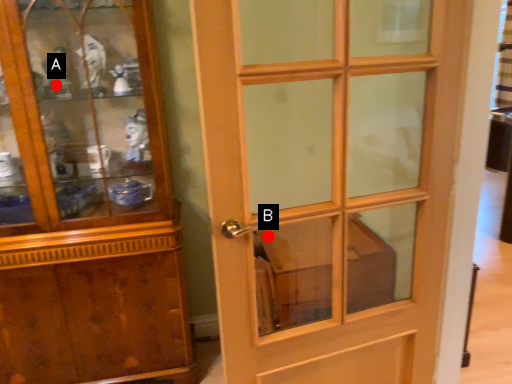
Question: Two points are circled on the image, labeled by A and B beside each circle. Which point is further to the camera?

Choices:
 (A) A is further
 (B) B is further

Answer: (B)